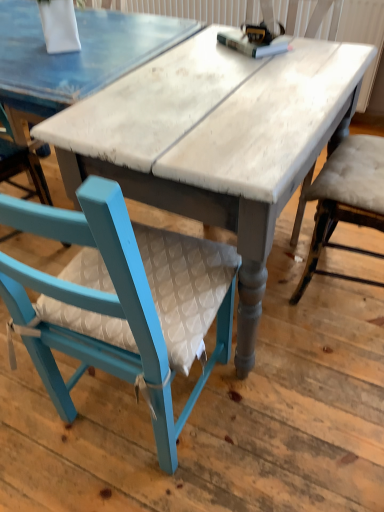
Question: Is teal painted wood chair at lower left behind white painted wood table at center?

Choices:
 (A) no
 (B) yes

Answer: (A)

Question: Does teal painted wood chair at lower left turn towards white painted wood table at center?

Choices:
 (A) no
 (B) yes

Answer: (B)

Question: Considering the relative positions of teal painted wood chair at lower left and white painted wood table at center in the image provided, is teal painted wood chair at lower left in front of white painted wood table at center?

Choices:
 (A) no
 (B) yes

Answer: (B)

Question: From a real-world perspective, is teal painted wood chair at lower left positioned over white painted wood table at center based on gravity?

Choices:
 (A) yes
 (B) no

Answer: (A)

Question: Is teal painted wood chair at lower left at the left side of white painted wood table at center?

Choices:
 (A) yes
 (B) no

Answer: (A)

Question: Can you confirm if teal painted wood chair at lower left is shorter than white painted wood table at center?

Choices:
 (A) no
 (B) yes

Answer: (A)

Question: Considering the relative positions of white painted wood table at center and teal painted wood chair at lower left in the image provided, is white painted wood table at center to the right of teal painted wood chair at lower left from the viewer's perspective?

Choices:
 (A) yes
 (B) no

Answer: (A)

Question: Does white painted wood table at center touch teal painted wood chair at lower left?

Choices:
 (A) yes
 (B) no

Answer: (B)

Question: Is the position of white painted wood table at center more distant than that of teal painted wood chair at lower left?

Choices:
 (A) yes
 (B) no

Answer: (A)

Question: Would you say teal painted wood chair at lower left is part of white painted wood table at center's contents?

Choices:
 (A) yes
 (B) no

Answer: (B)

Question: From the image's perspective, is white painted wood table at center over teal painted wood chair at lower left?

Choices:
 (A) no
 (B) yes

Answer: (B)

Question: Would you say white painted wood table at center is outside teal painted wood chair at lower left?

Choices:
 (A) no
 (B) yes

Answer: (B)

Question: From the image's perspective, is teal painted wood chair at lower left positioned above or below white painted wood table at center?

Choices:
 (A) above
 (B) below

Answer: (B)